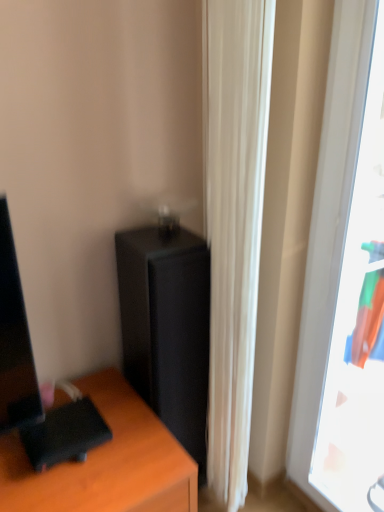
Question: Would you say white fabric curtain at center contains black matte/file cabinet at center?

Choices:
 (A) no
 (B) yes

Answer: (A)

Question: Does white fabric curtain at center have a lesser width compared to black matte/file cabinet at center?

Choices:
 (A) yes
 (B) no

Answer: (A)

Question: Considering the relative positions of white fabric curtain at center and black matte/file cabinet at center in the image provided, is white fabric curtain at center to the right of black matte/file cabinet at center from the viewer's perspective?

Choices:
 (A) no
 (B) yes

Answer: (B)

Question: Is white fabric curtain at center aimed at black matte/file cabinet at center?

Choices:
 (A) no
 (B) yes

Answer: (A)

Question: Is white fabric curtain at center taller than black matte/file cabinet at center?

Choices:
 (A) no
 (B) yes

Answer: (B)

Question: Is white fabric curtain at center smaller than black matte/file cabinet at center?

Choices:
 (A) no
 (B) yes

Answer: (B)

Question: Considering the relative sizes of white fabric curtain at center and transparent plastic window at right in the image provided, is white fabric curtain at center shorter than transparent plastic window at right?

Choices:
 (A) no
 (B) yes

Answer: (A)

Question: Can you confirm if white fabric curtain at center is taller than transparent plastic window at right?

Choices:
 (A) yes
 (B) no

Answer: (A)

Question: Is transparent plastic window at right at the back of white fabric curtain at center?

Choices:
 (A) yes
 (B) no

Answer: (B)

Question: From a real-world perspective, is white fabric curtain at center positioned under transparent plastic window at right based on gravity?

Choices:
 (A) yes
 (B) no

Answer: (A)

Question: From the image's perspective, is white fabric curtain at center above transparent plastic window at right?

Choices:
 (A) yes
 (B) no

Answer: (A)

Question: Are white fabric curtain at center and transparent plastic window at right far apart?

Choices:
 (A) no
 (B) yes

Answer: (A)

Question: Could you tell me if transparent plastic window at right is turned towards black matte/file cabinet at center?

Choices:
 (A) yes
 (B) no

Answer: (B)